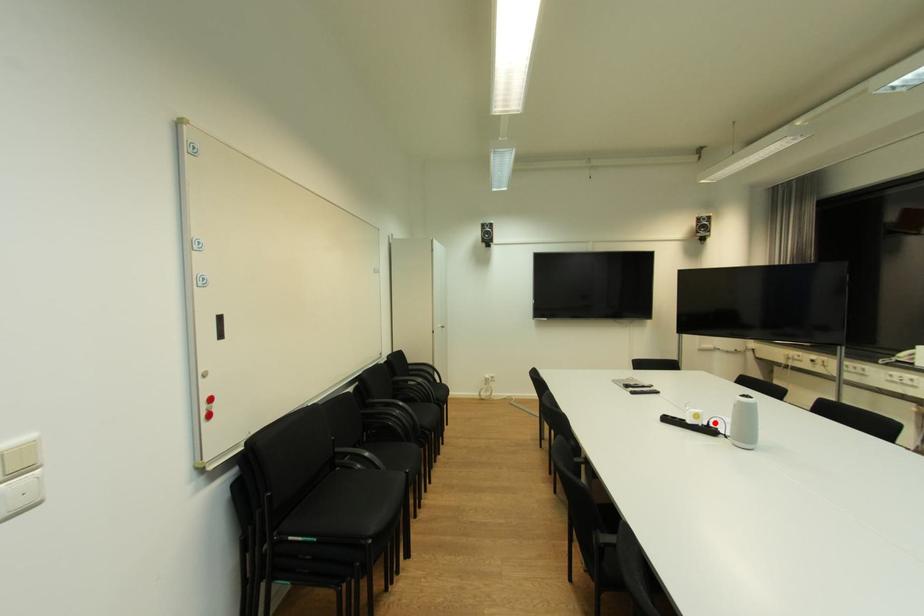
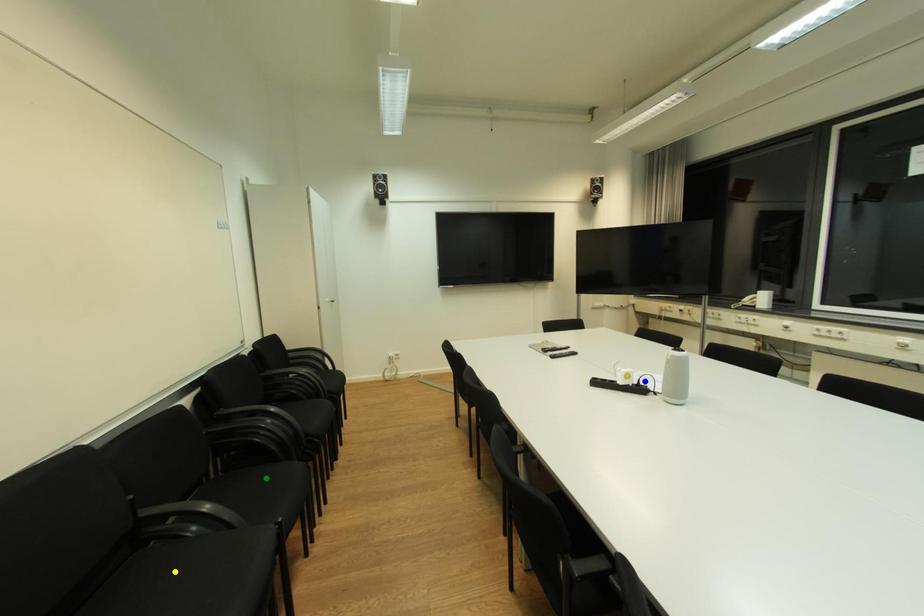
Question: I am providing you with two images of the same scene from different viewpoints. A red point is marked on the first image. You are given multiple points on the second image. In image 2, which mark is for the same physical point as the one in image 1?

Choices:
 (A) yellow point
 (B) blue point
 (C) green point

Answer: (B)